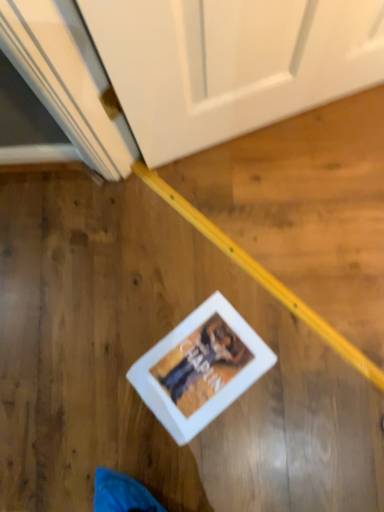
You are a GUI agent. You are given a task and a screenshot of the screen. Output one action in this format:
    pyautogui.click(x=<x>, y=<y>)
    Task: Click on the white matte picture frame at lower center
    This screenshot has width=384, height=512.
    Given the screenshot: What is the action you would take?
    pyautogui.click(x=200, y=368)

What is the approximate height of white matte picture frame at lower center?

white matte picture frame at lower center is 0.60 inches tall.

In order to face white matte picture frame at lower center, should I rotate leftwards or rightwards?

Rotate right and turn 1.118 degrees.

Measure the distance between point (195, 339) and camera.

A distance of 1.01 meters exists between point (195, 339) and camera.

What do you see at coordinates (200, 368) in the screenshot? This screenshot has height=512, width=384. I see `white matte picture frame at lower center` at bounding box center [200, 368].

This screenshot has height=512, width=384. Find the location of `white matte picture frame at lower center`. white matte picture frame at lower center is located at coordinates (200, 368).